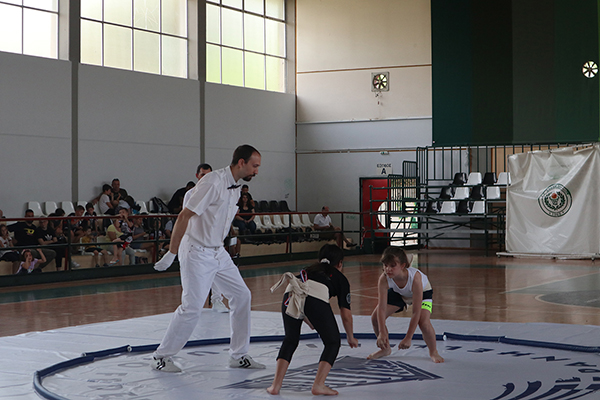
I want to click on window, so click(x=149, y=40).